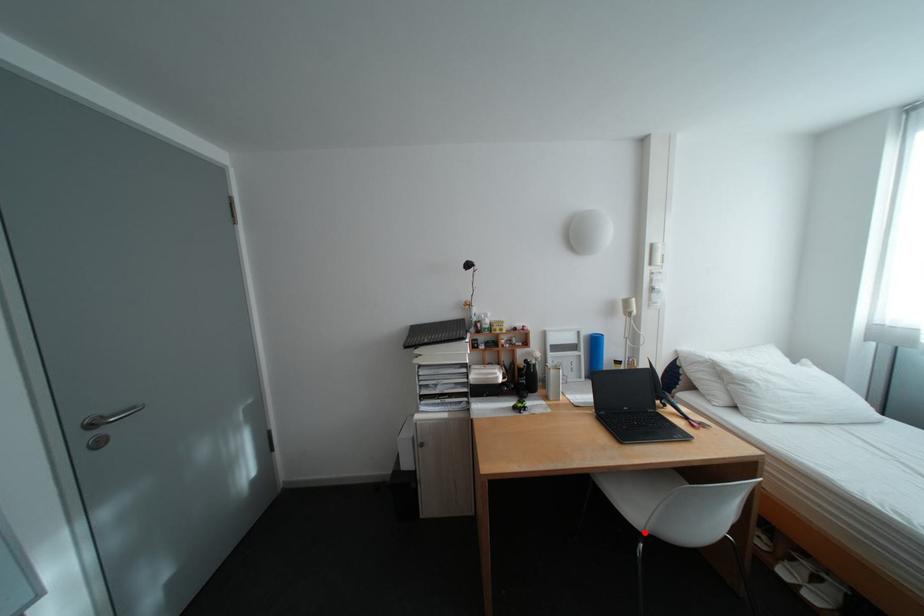
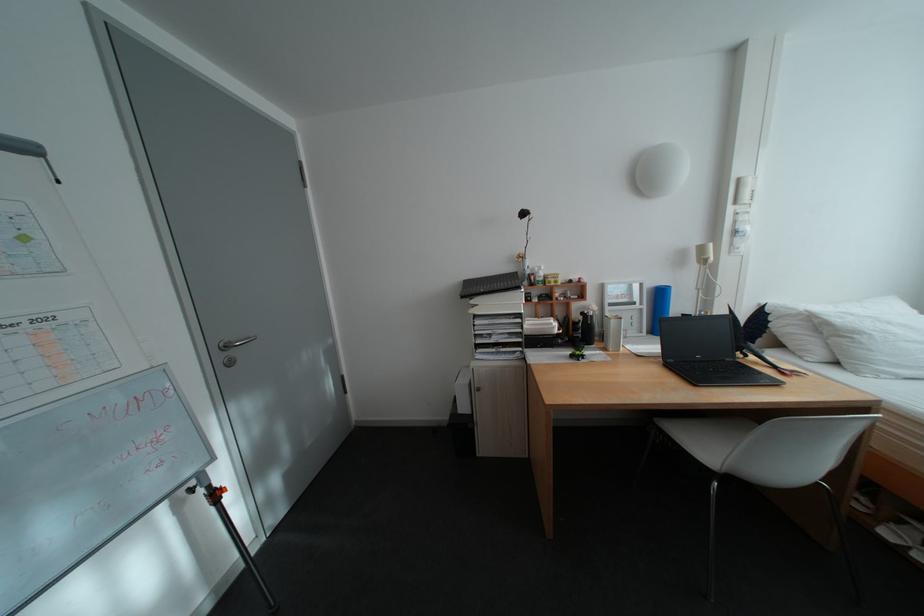
Find the pixel in the second image that matches the highlighted location in the first image.

(718, 472)